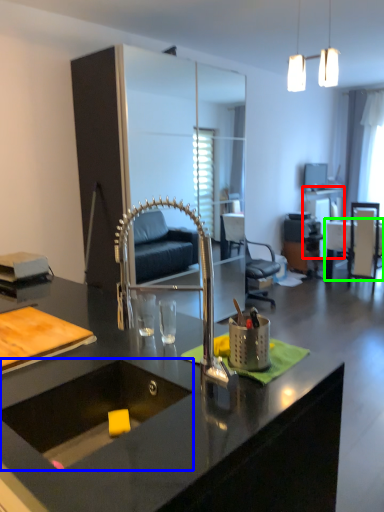
Question: Which is farther away from table (highlighted by a red box)? sink (highlighted by a blue box) or table (highlighted by a green box)?

Choices:
 (A) sink
 (B) table

Answer: (A)